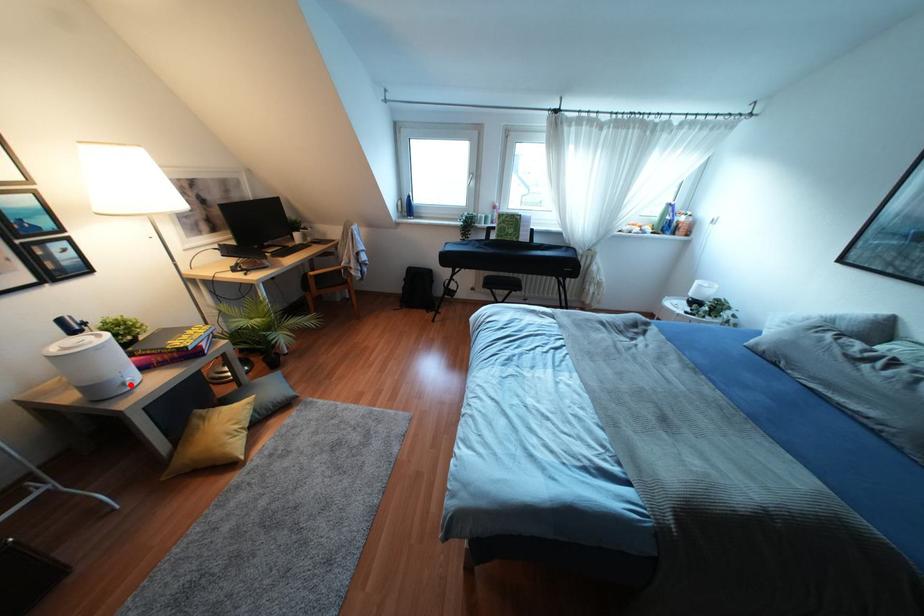
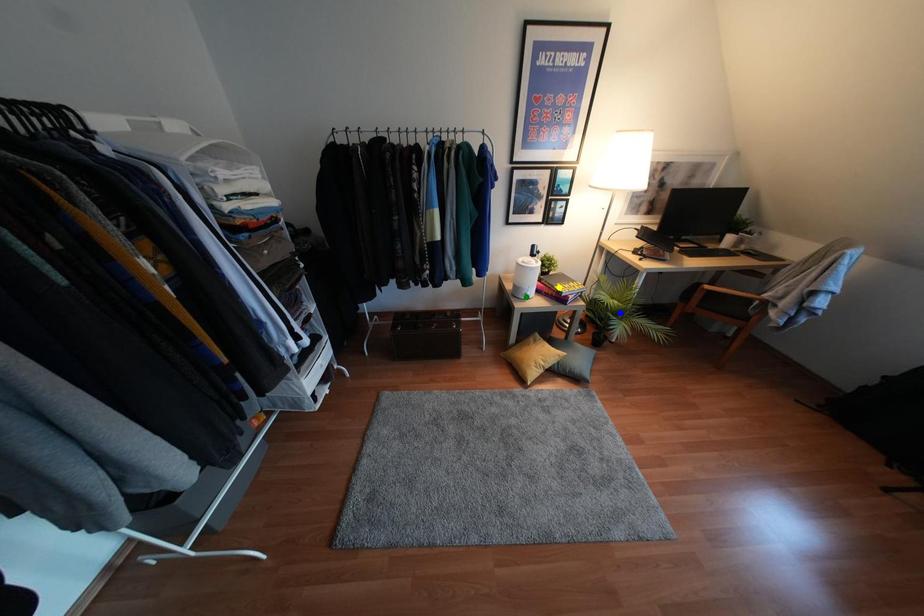
Question: I am providing you with two images of the same scene from different viewpoints. A red point is marked on the first image. You are given multiple points on the second image. Which point in image 2 is actually the same real-world point as the red point in image 1?

Choices:
 (A) yellow point
 (B) blue point
 (C) green point

Answer: (C)